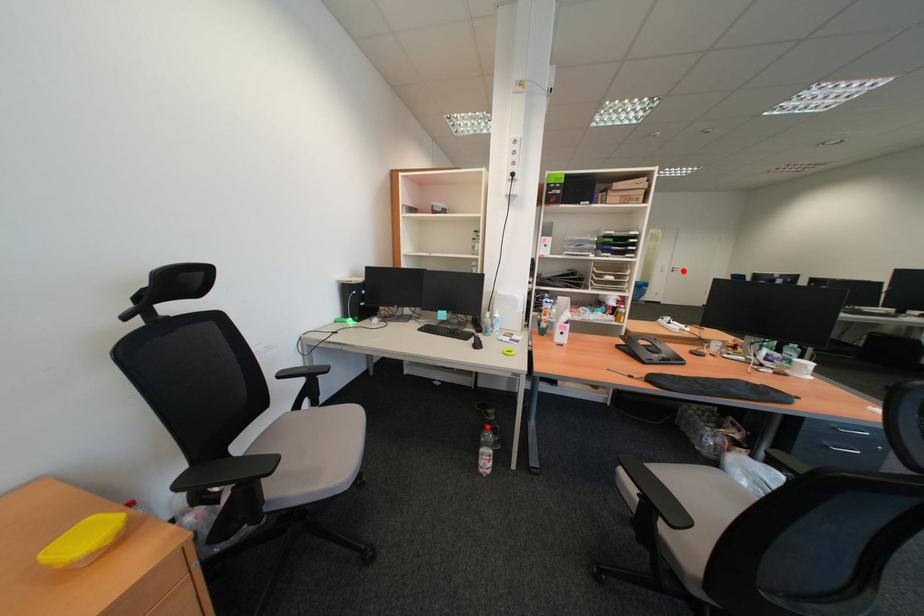
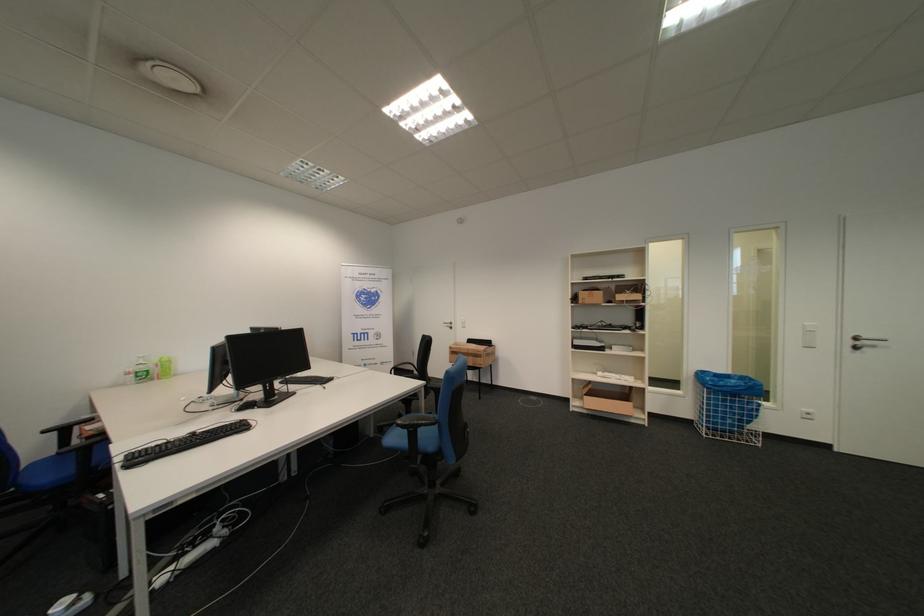
Question: I am providing you with two images of the same scene from different viewpoints. Given a red point in image1, look at the same physical point in image2. Is it:

Choices:
 (A) Closer to the viewpoint
 (B) Farther from the viewpoint

Answer: (B)